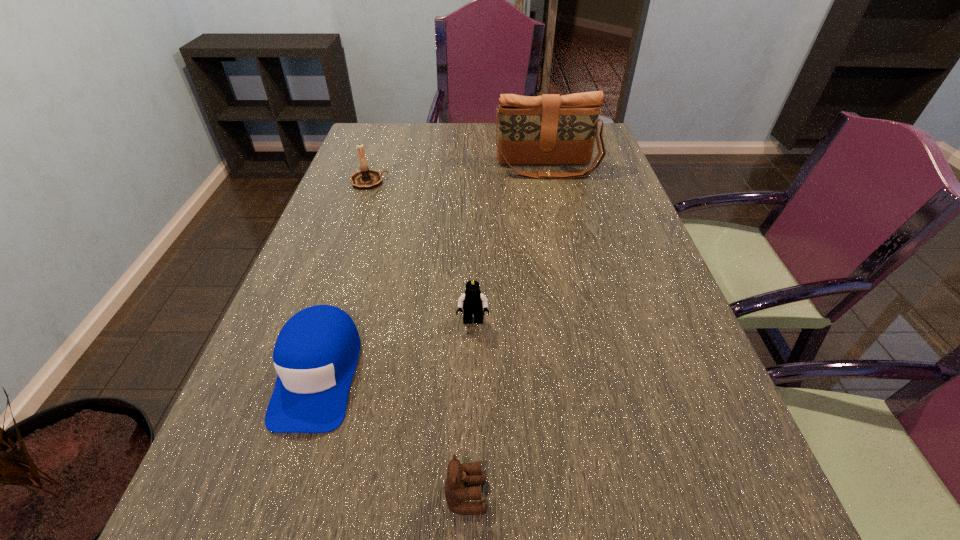
Find the location of a particular element. vacant space that satisfies the following two spatial constraints: 1. on the front-facing side of the Lego; 2. on the face of the teddy bear is located at coordinates (470, 496).

What are the coordinates of `blank space that satisfies the following two spatial constraints: 1. on the front-facing side of the tallest object; 2. on the face of the nearest object` in the screenshot? It's located at (619, 496).

Image resolution: width=960 pixels, height=540 pixels. Find the location of `vacant space that satisfies the following two spatial constraints: 1. on the front-facing side of the Lego; 2. on the face of the teddy bear`. vacant space that satisfies the following two spatial constraints: 1. on the front-facing side of the Lego; 2. on the face of the teddy bear is located at coordinates (470, 496).